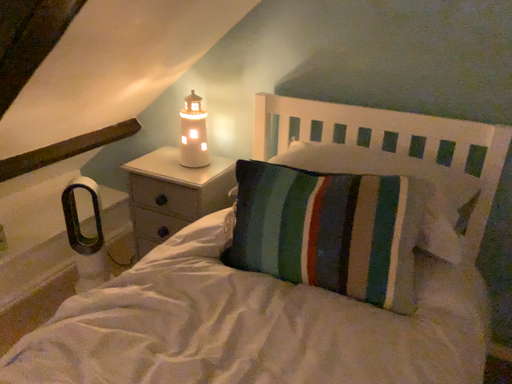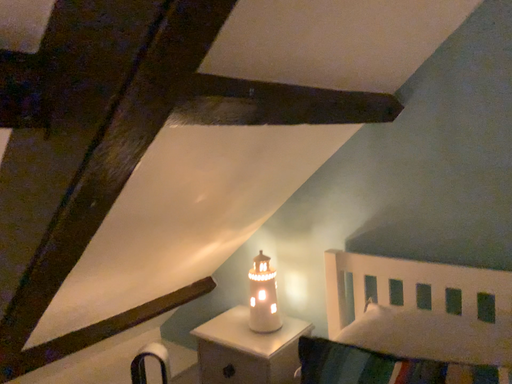
Question: How did the camera likely rotate when shooting the video?

Choices:
 (A) rotated right
 (B) rotated left

Answer: (B)